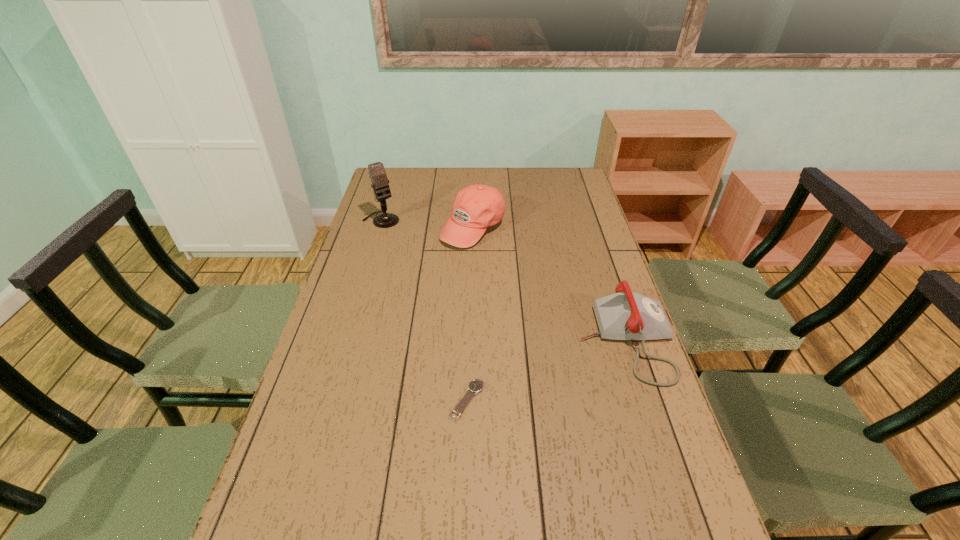
Image resolution: width=960 pixels, height=540 pixels. Find the location of `vacant space located on the front-facing side of the leftmost object`. vacant space located on the front-facing side of the leftmost object is located at coordinates (443, 283).

Locate an element on the screen. free location located on the front-facing side of the leftmost object is located at coordinates (412, 251).

Locate an element on the screen. The height and width of the screenshot is (540, 960). free space located on the front-facing side of the leftmost object is located at coordinates point(426,265).

Where is `object that is at the left edge`? object that is at the left edge is located at coordinates (377, 173).

This screenshot has width=960, height=540. Identify the location of object located in the right edge section of the desktop. (624, 315).

You are a GUI agent. You are given a task and a screenshot of the screen. Output one action in this format:
    pyautogui.click(x=<x>, y=<y>)
    Task: Click on the free spot at the far edge of the desktop
    The height and width of the screenshot is (540, 960).
    Given the screenshot: What is the action you would take?
    pyautogui.click(x=425, y=189)

Identify the location of blank space at the near edge of the desktop. This screenshot has height=540, width=960. (536, 512).

The width and height of the screenshot is (960, 540). In order to click on vacant space at the left edge in this screenshot , I will do `click(345, 310)`.

Find the location of a particular element. The height and width of the screenshot is (540, 960). blank space at the right edge is located at coordinates (586, 322).

Where is `vacant region at the far left corner of the desktop`? The image size is (960, 540). vacant region at the far left corner of the desktop is located at coordinates (386, 167).